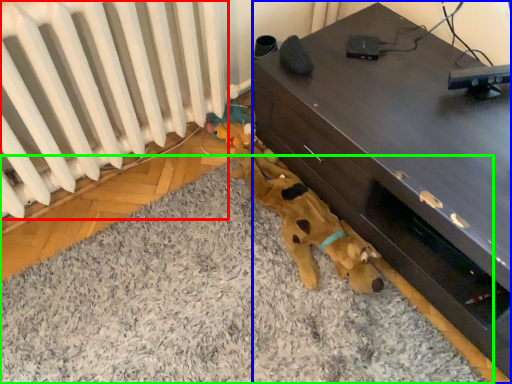
Question: Which object is positioned closest to radiator (highlighted by a red box)? Select from furniture (highlighted by a blue box) and mat (highlighted by a green box).

Choices:
 (A) furniture
 (B) mat

Answer: (B)